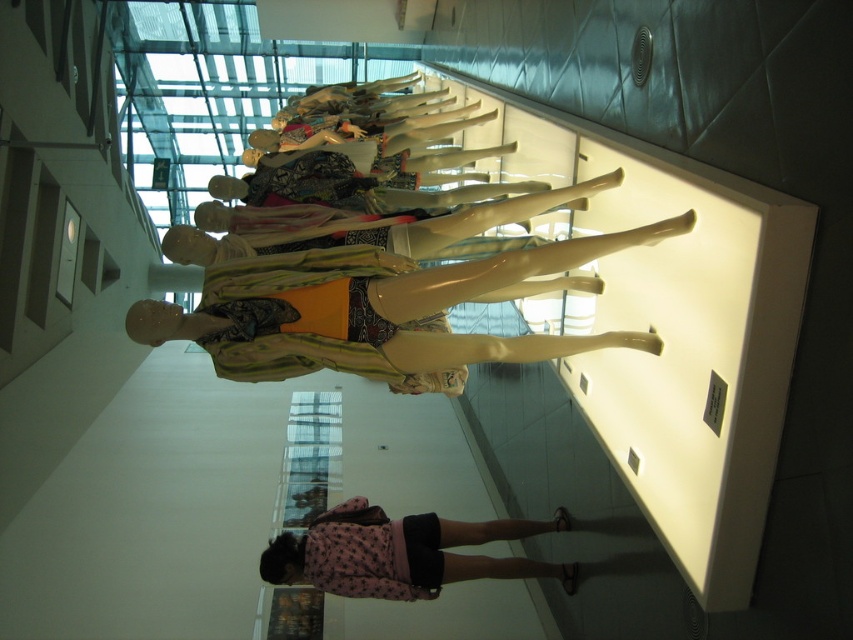
You are a fashion designer observing the display case in the gallery. You need to adjust the placement of the matte yellow mannequin at center and the pink fabric dress at lower center so that the dress is now to the left of the mannequin. Is this possible given their current arrangement?

The matte yellow mannequin at center is currently positioned on the left side of the pink fabric dress at lower center. To move the dress to the left of the mannequin, you would need to swap their positions, which is possible as they are separate objects within the display case.